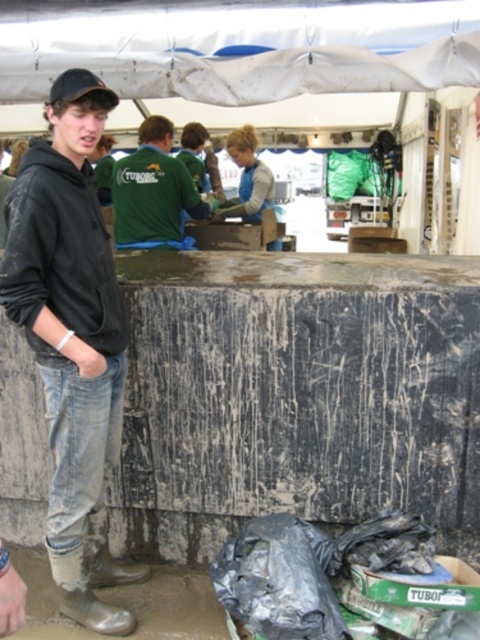
Question: Among these points, which one is nearest to the camera?

Choices:
 (A) (115, 316)
 (B) (101, 81)
 (C) (374, 81)

Answer: (A)

Question: Among these objects, which one is nearest to the camera?

Choices:
 (A) black matte hoodie at left
 (B) white tarpaulin canopy at upper center
 (C) black matte baseball cap at upper left
 (D) green fabric shirt at center

Answer: (A)

Question: Which of the following is the closest to the observer?

Choices:
 (A) (96, 81)
 (B) (333, 58)
 (C) (153, 195)

Answer: (A)

Question: Does green fabric shirt at center appear under black matte baseball cap at upper left?

Choices:
 (A) yes
 (B) no

Answer: (B)

Question: Can you confirm if green fabric shirt at center is positioned above black matte baseball cap at upper left?

Choices:
 (A) no
 (B) yes

Answer: (B)

Question: Can you confirm if black matte hoodie at left is thinner than white tarpaulin canopy at upper center?

Choices:
 (A) yes
 (B) no

Answer: (A)